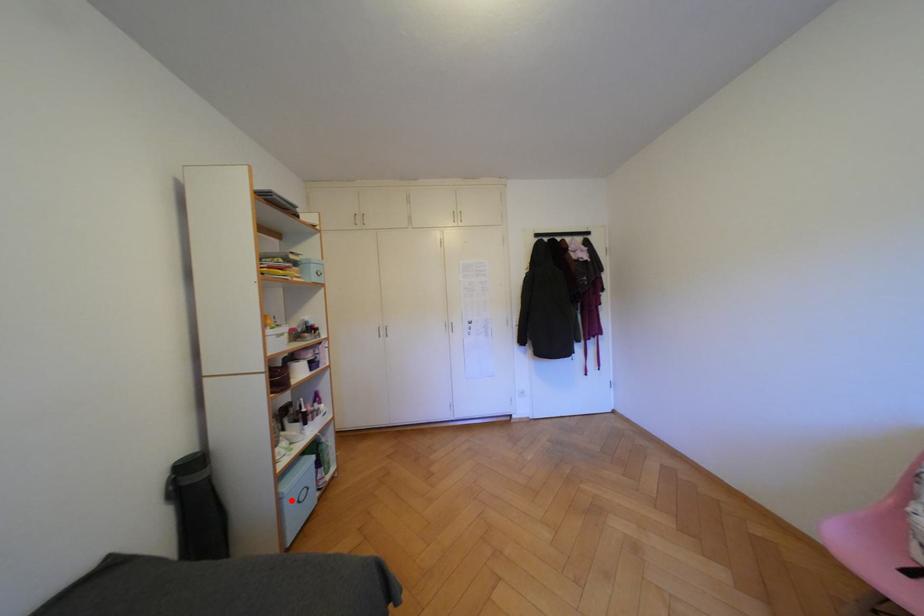
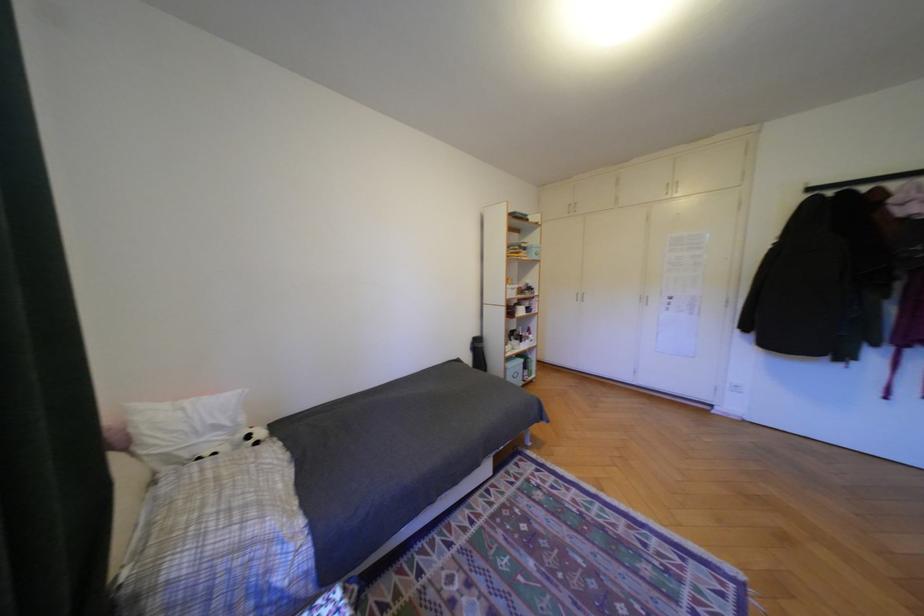
Where in the second image is the point corresponding to the highlighted location from the first image?

(517, 370)